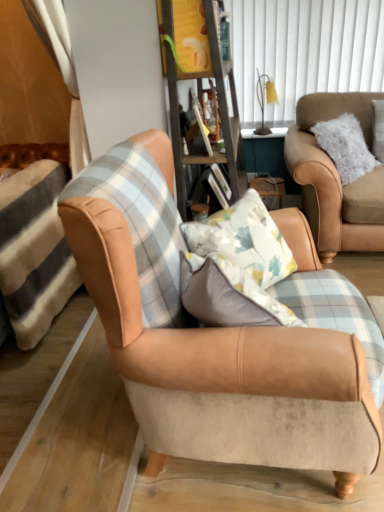
Question: In terms of size, does tan suede armchair at center, the 2th chair when ordered from right to left, appear bigger or smaller than white vertical blinds at upper center?

Choices:
 (A) small
 (B) big

Answer: (B)

Question: Does point (327, 462) appear closer or farther from the camera than point (309, 44)?

Choices:
 (A) closer
 (B) farther

Answer: (A)

Question: Considering the real-world distances, which object is farthest from the yellow fabric lampshade at upper center?

Choices:
 (A) suede tan armchair at right, the second chair when ordered from left to right
 (B) tan suede armchair at center, the 1th chair when ordered from front to back
 (C) white vertical blinds at upper center
 (D) wooden bookshelf at center

Answer: (B)

Question: Considering the real-world distances, which object is farthest from the suede tan armchair at right, placed as the 1th chair when sorted from right to left?

Choices:
 (A) white vertical blinds at upper center
 (B) yellow fabric lampshade at upper center
 (C) tan suede armchair at center, the 2th chair when ordered from right to left
 (D) wooden bookshelf at center

Answer: (C)